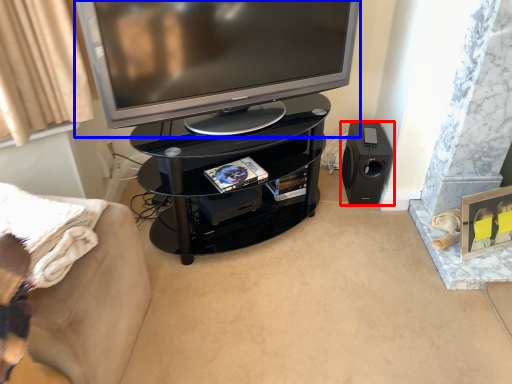
Question: Which object is further to the camera taking this photo, loudspeaker (highlighted by a red box) or television (highlighted by a blue box)?

Choices:
 (A) loudspeaker
 (B) television

Answer: (A)